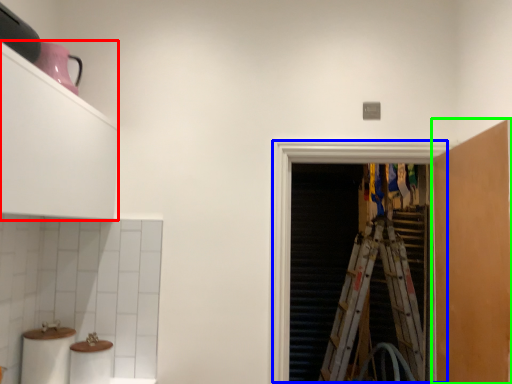
Question: Based on their relative distances, which object is nearer to cabinetry (highlighted by a red box)? Choose from screen door (highlighted by a blue box) and cabinetry (highlighted by a green box).

Choices:
 (A) screen door
 (B) cabinetry

Answer: (A)